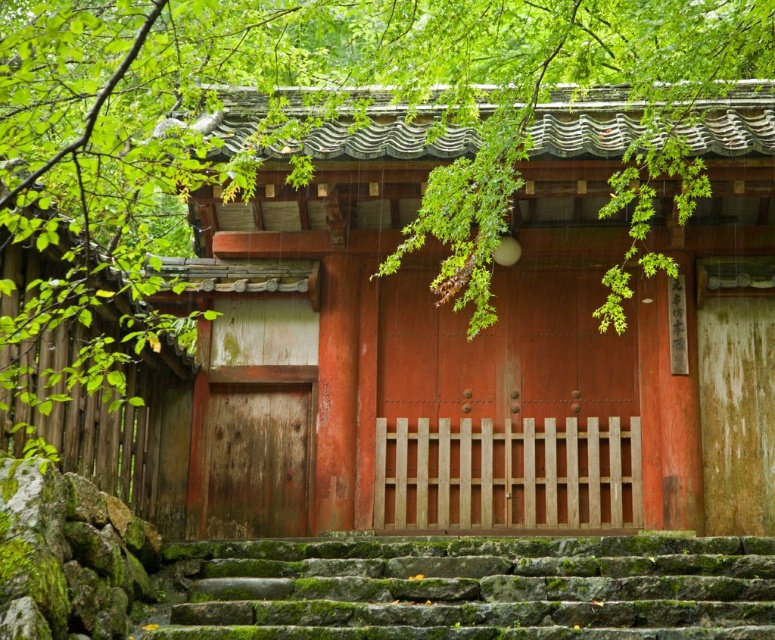
You are standing in front of the temple and notice two points marked on the structure. The first point is at coordinate point (167,88) and the second is at point (612,628). Which of these points is nearer to your current position?

Point (167,88) is closer to the viewer than point (612,628), so the first point is nearer to your current position.

You are a visitor approaching the temple and need to reach the wooden gate at center. There are green mossy stone stairs at lower center in your path. Based on their heights, which one should you step onto first?

Since the green mossy stone stairs at lower center are shorter in height than the wooden gate at center, you should step onto the green mossy stone stairs at lower center first to reach the wooden gate at center.

You are a visitor approaching the temple and want to enter through the wooden gate at center. Which direction should you move relative to the green mossy stone stairs at lower center?

To enter through the wooden gate at center, you should move forward from the green mossy stone stairs at lower center since the stairs are in front of the gate.